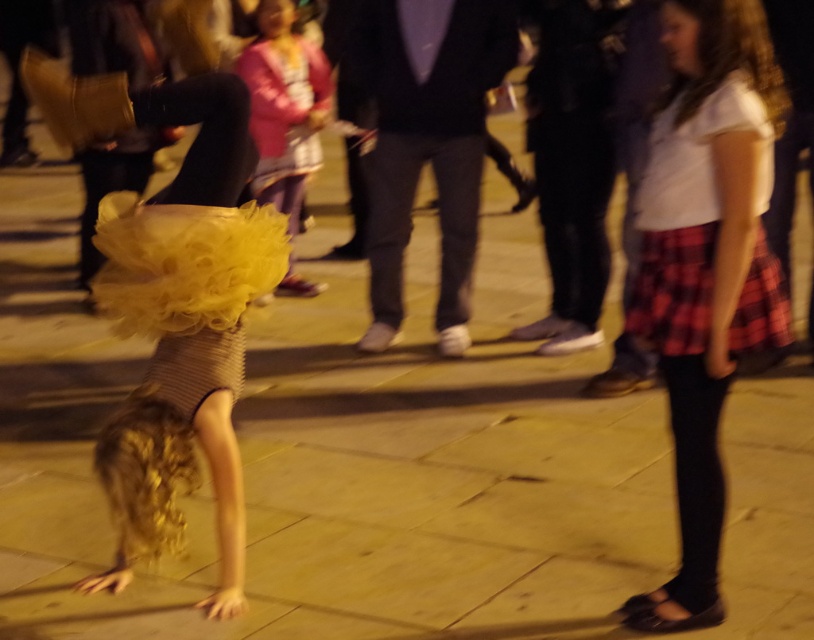
You are a photographer trying to capture the scene. The matte black leotard at center and the red plaid skirt at right are both in your viewfinder. Which object should you focus on first if you want to ensure both are in focus without moving the camera?

The matte black leotard at center is located above the red plaid skirt at right, so focusing on the matte black leotard at center first will help ensure both are in focus since it is closer to the camera.

You are a photographer trying to capture a clear shot of the matte black leotard at center and the red plaid skirt at right. Based on their positions, which one is closer to the camera?

The matte black leotard at center is closer to the camera since the red plaid skirt at right is behind it.

You are a photographer trying to capture a photo of the scene. You need to ensure that both the white cotton shirt at upper right and the matte pink sweater at center are visible in your shot. Based on their positions, which one should you focus on first to frame the shot properly?

The white cotton shirt at upper right is located below the matte pink sweater at center, so you should focus on the matte pink sweater at center first to ensure both are in frame.